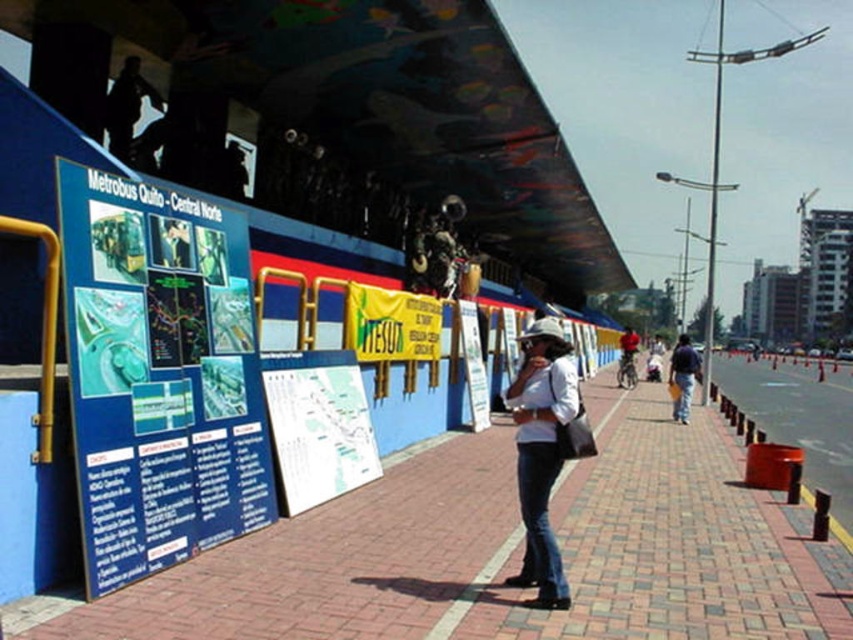
Question: Which of the following is the closest to the observer?

Choices:
 (A) blue cardboard poster at left
 (B) dark blue jeans at center
 (C) red fabric jacket at center
 (D) white matte shirt at center

Answer: (A)

Question: Does white paper map at center have a greater width compared to orange plastic barrier at right?

Choices:
 (A) yes
 (B) no

Answer: (B)

Question: Is white paper map at center further to the viewer compared to orange plastic barrier at right?

Choices:
 (A) yes
 (B) no

Answer: (B)

Question: Which object appears farthest from the camera in this image?

Choices:
 (A) dark blue jeans at center
 (B) red fabric jacket at center
 (C) white cotton shirt at center

Answer: (C)

Question: Estimate the real-world distances between objects in this image. Which object is farther from the white cotton shirt at center?

Choices:
 (A) yellow paper sign at center
 (B) white matte shirt at center
 (C) white paper map at center
 (D) brick pavement at center

Answer: (B)

Question: Can you confirm if blue cardboard poster at left is wider than orange plastic barrier at right?

Choices:
 (A) yes
 (B) no

Answer: (B)